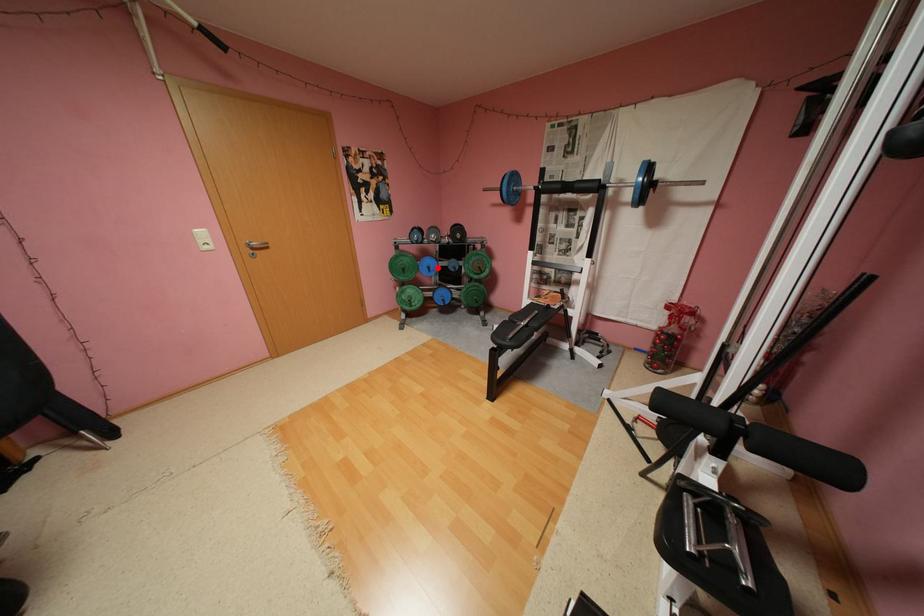
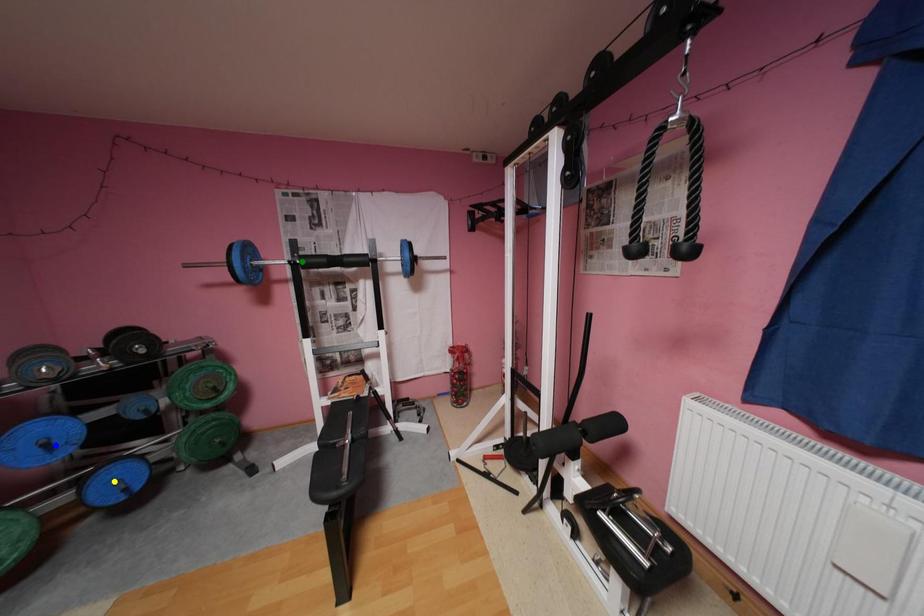
Question: I am providing you with two images of the same scene from different viewpoints. A red point is marked on the first image. You are given multiple points on the second image. Which point in image 2 is actually the same real-world point as the red point in image 1?

Choices:
 (A) yellow point
 (B) green point
 (C) blue point

Answer: (C)